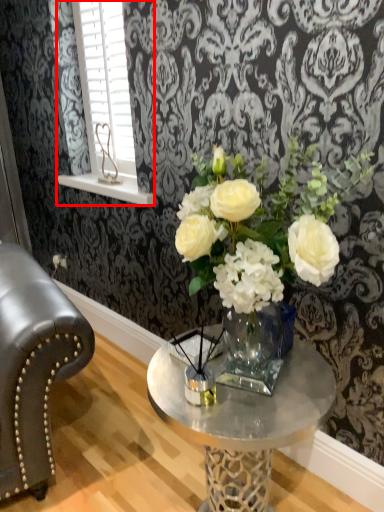
Question: Observing the image, what is the correct spatial positioning of window (annotated by the red box) in reference to coffee table?

Choices:
 (A) left
 (B) right

Answer: (A)